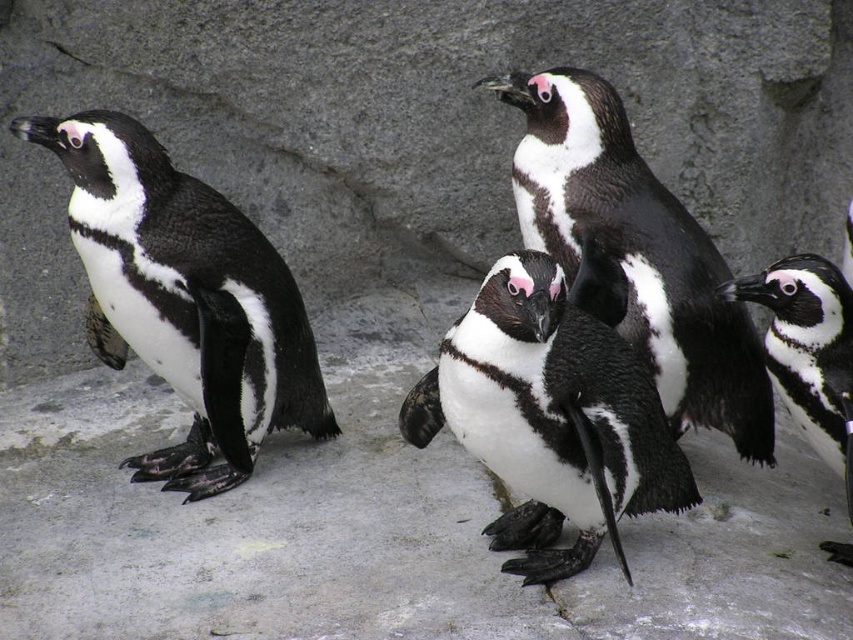
Question: Is white matte penguin at center bigger than black matte penguin at right?

Choices:
 (A) no
 (B) yes

Answer: (B)

Question: Can you confirm if black and white feathers at center is positioned below black matte penguin at right?

Choices:
 (A) yes
 (B) no

Answer: (B)

Question: Which point is farther from the camera taking this photo?

Choices:
 (A) (824, 445)
 (B) (563, 392)

Answer: (A)

Question: Which point is closer to the camera taking this photo?

Choices:
 (A) coord(503,378)
 (B) coord(167,474)

Answer: (A)

Question: Among these objects, which one is nearest to the camera?

Choices:
 (A) white matte penguin at center
 (B) black glossy penguin at left
 (C) black and white feathers at center
 (D) black matte penguin at right

Answer: (A)

Question: Is black glossy penguin at left smaller than black matte penguin at right?

Choices:
 (A) yes
 (B) no

Answer: (B)